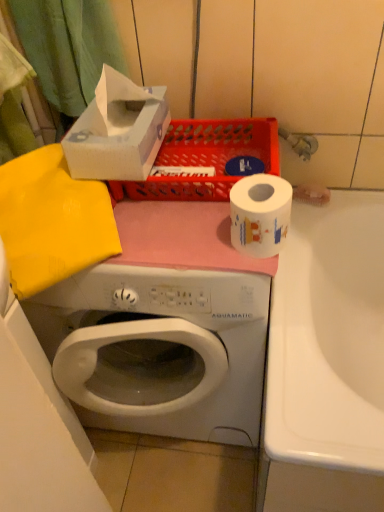
Question: In the image, is matte plastic basket at upper center on the left side or the right side of white glossy toilet paper at center?

Choices:
 (A) left
 (B) right

Answer: (A)

Question: From a real-world perspective, relative to white glossy toilet paper at center, is matte plastic basket at upper center vertically above or below?

Choices:
 (A) below
 (B) above

Answer: (A)

Question: Considering the real-world distances, which object is farthest from the matte plastic basket at upper center?

Choices:
 (A) white cardboard tissue box at upper left
 (B) white glossy toilet paper at center

Answer: (B)

Question: Estimate the real-world distances between objects in this image. Which object is closer to the white glossy toilet paper at center?

Choices:
 (A) matte plastic basket at upper center
 (B) white cardboard tissue box at upper left

Answer: (A)